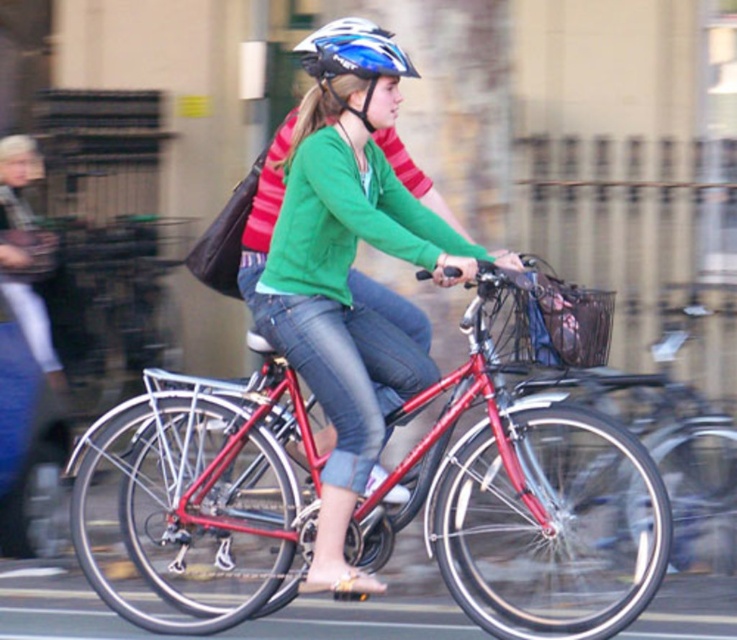
Is shiny metallic bicycle at center wider than blue matte helmet at upper center?

Yes, shiny metallic bicycle at center is wider than blue matte helmet at upper center.

Can you confirm if shiny metallic bicycle at center is taller than blue matte helmet at upper center?

Correct, shiny metallic bicycle at center is much taller as blue matte helmet at upper center.

The height and width of the screenshot is (640, 737). What do you see at coordinates (534, 484) in the screenshot?
I see `shiny metallic bicycle at center` at bounding box center [534, 484].

This screenshot has width=737, height=640. Find the location of `shiny metallic bicycle at center`. shiny metallic bicycle at center is located at coordinates (534, 484).

Which is behind, point (289, 324) or point (368, 125)?

The point (368, 125) is more distant.

This screenshot has height=640, width=737. What do you see at coordinates (349, 273) in the screenshot?
I see `matte green sweater at center` at bounding box center [349, 273].

At what (x,y) coordinates should I click in order to perform the action: click on matte green sweater at center. Please return your answer as a coordinate pair (x, y). Looking at the image, I should click on (349, 273).

Is shiny metallic bicycle at center wider than matte green sweater at center?

Yes, shiny metallic bicycle at center is wider than matte green sweater at center.

Does shiny metallic bicycle at center appear under matte green sweater at center?

Correct, shiny metallic bicycle at center is located below matte green sweater at center.

You are a GUI agent. You are given a task and a screenshot of the screen. Output one action in this format:
    pyautogui.click(x=<x>, y=<y>)
    Task: Click on the shiny metallic bicycle at center
    Image resolution: width=737 pixels, height=640 pixels.
    Given the screenshot: What is the action you would take?
    pyautogui.click(x=534, y=484)